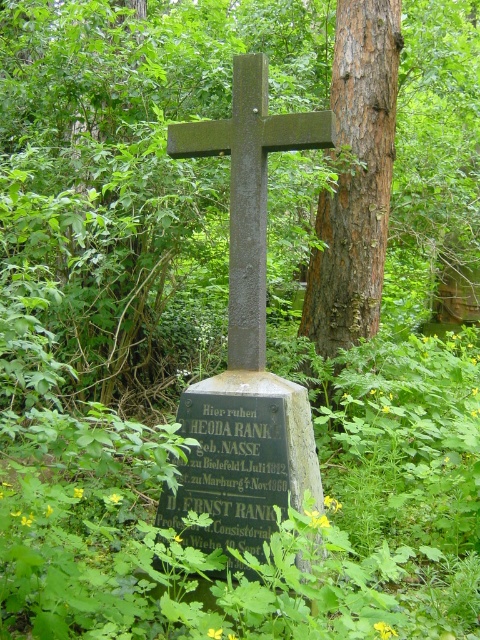
Question: Among these points, which one is nearest to the camera?

Choices:
 (A) (240, 157)
 (B) (362, 32)
 (C) (277, 499)

Answer: (C)

Question: Which of the following is the farthest from the observer?

Choices:
 (A) (249, 529)
 (B) (232, 145)

Answer: (B)

Question: Does brown rough bark tree at center have a lesser width compared to black stone plaque at center?

Choices:
 (A) no
 (B) yes

Answer: (A)

Question: Does brown rough bark tree at center have a smaller size compared to dark gray stone cross at center?

Choices:
 (A) no
 (B) yes

Answer: (A)

Question: Where is brown rough bark tree at center located in relation to dark gray stone cross at center in the image?

Choices:
 (A) above
 (B) below

Answer: (A)

Question: Which point is farther to the camera?

Choices:
 (A) (247, 433)
 (B) (348, 116)

Answer: (B)